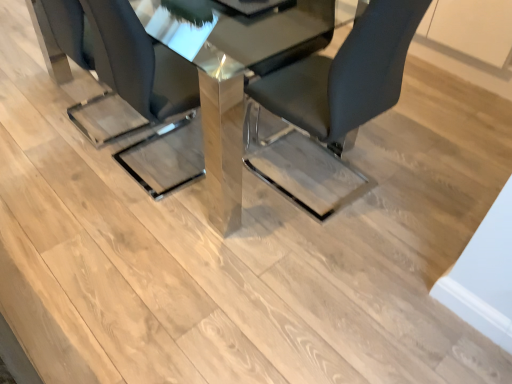
Question: Looking at their shapes, would you say polished glass table at center is wider or thinner than matte black chair at center, arranged as the 1th chair when viewed from the left?

Choices:
 (A) thin
 (B) wide

Answer: (B)

Question: Based on their sizes in the image, would you say polished glass table at center is bigger or smaller than matte black chair at center, arranged as the 1th chair when viewed from the left?

Choices:
 (A) big
 (B) small

Answer: (A)

Question: Which of these objects is positioned closest to the black leather chair at center, which ranks as the 1th chair in right-to-left order?

Choices:
 (A) matte black chair at center, arranged as the 1th chair when viewed from the left
 (B) polished glass table at center

Answer: (B)

Question: Which object is the closest to the matte black chair at center, arranged as the 1th chair when viewed from the left?

Choices:
 (A) black leather chair at center, which ranks as the second chair in left-to-right order
 (B) polished glass table at center

Answer: (B)